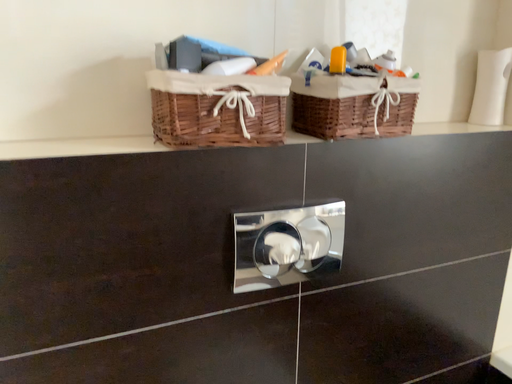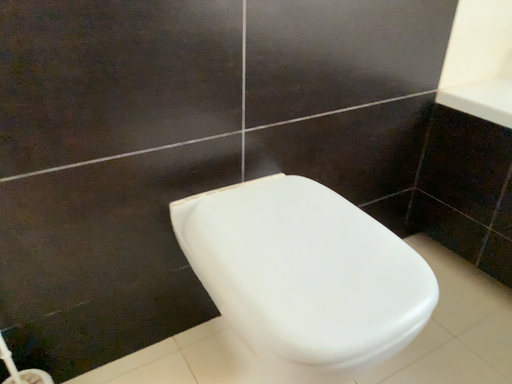
Question: How did the camera likely rotate when shooting the video?

Choices:
 (A) rotated left
 (B) rotated right

Answer: (B)